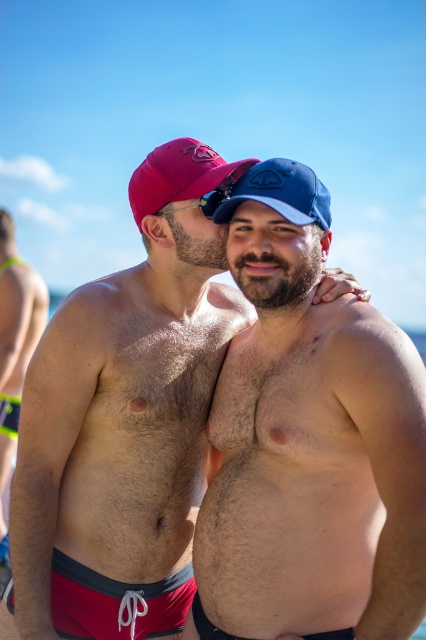
You are a photographer at the beach. You want to take a photo of the blue fabric baseball cap at upper center and the black rubber goggles at center. Which object should you focus on first if you want to capture both in the same frame without moving the camera?

The blue fabric baseball cap at upper center is located above the black rubber goggles at center, so you should focus on the blue fabric baseball cap at upper center first to ensure both are in focus.

You are a photographer trying to capture a candid shot of the blue fabric baseball cap at upper center and the black rubber goggles at center. Since you want to focus on the cap, which object should you adjust your camera lens to prioritize in terms of size in the frame?

The blue fabric baseball cap at upper center is taller than the black rubber goggles at center, so you should adjust your camera lens to prioritize the blue fabric baseball cap at upper center as it already has a larger size in the frame.

You are a photographer at the beach. You need to capture a closeup shot of the black rubber goggles at center without the hairy skin at center appearing in the frame. Is this possible based on their sizes?

The hairy skin at center is taller than black rubber goggles at center, so it might block the view of the goggles. Adjust your angle or position to ensure the goggles are framed without the skin obstructing them.